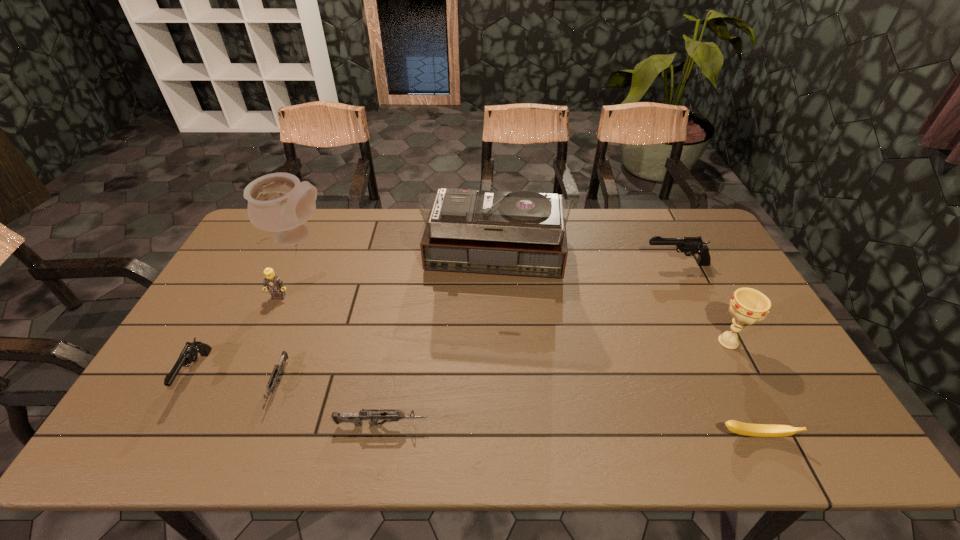
What are the coordinates of `the third gun from left to right` in the screenshot? It's located at (373, 415).

Identify the location of banana. The width and height of the screenshot is (960, 540). (756, 430).

Locate an element on the screen. This screenshot has height=540, width=960. yellow banana is located at coordinates (756, 430).

Image resolution: width=960 pixels, height=540 pixels. I want to click on the second gun from left to right, so click(279, 367).

Locate an element on the screen. the smaller grey gun is located at coordinates (279, 367).

The width and height of the screenshot is (960, 540). I want to click on vacant region located 0.160m on the left of the tallest object, so click(x=375, y=264).

Locate an element on the screen. This screenshot has height=540, width=960. vacant space located 0.290m on the right of the pottery is located at coordinates click(x=417, y=237).

You are a GUI agent. You are given a task and a screenshot of the screen. Output one action in this format:
    pyautogui.click(x=<x>, y=<y>)
    Task: Click on the free region located on the front of the seventh shortest object
    The height and width of the screenshot is (540, 960).
    Given the screenshot: What is the action you would take?
    pyautogui.click(x=785, y=453)

In order to click on vacant region located at the end of the barrel of the rightmost gun in this screenshot , I will do `click(555, 264)`.

At what (x,y) coordinates should I click in order to perform the action: click on vacant area situated 0.140m at the end of the barrel of the rightmost gun. Please return your answer as a coordinate pair (x, y). This screenshot has height=540, width=960. Looking at the image, I should click on (601, 264).